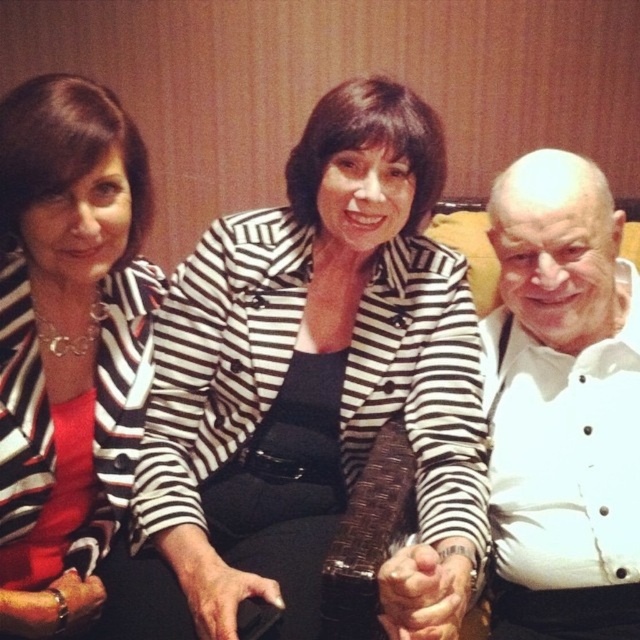
You are a photographer in a conference room setting. You need to place a small microphone stand at the point specified by the coordinates point (67, 342). According to the scene description, what object is located at that point?

The point (67, 342) indicates the location of the matte black blazer at upper left.

You are standing at the point marked by the coordinates point (12, 90). You want to walk straight ahead to the nearest person. Which person will you reach first?

The nearest person is the one closest to the point (12, 90). Since the distance between them is 2.13 meters, you will reach the first person after 2.13 meters of walking.

You are organizing a charity event and need to decide which item to display first between the matte black blazer at upper left and the white textured shirt at right. Based on their sizes, which one should you choose to place in a narrow display case that can only accommodate items up to the width of the thinner object?

The matte black blazer at upper left is thinner than the white textured shirt at right, so it would fit better in the narrow display case.